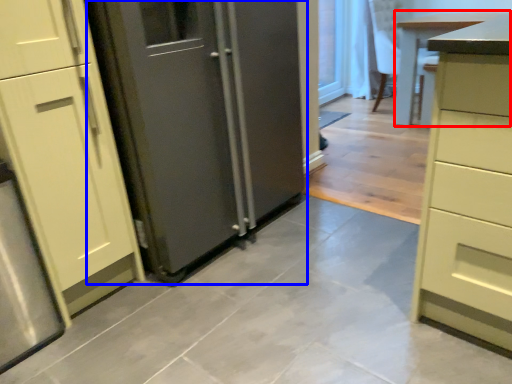
Question: Which object appears farthest to the camera in this image, table (highlighted by a red box) or door (highlighted by a blue box)?

Choices:
 (A) table
 (B) door

Answer: (A)